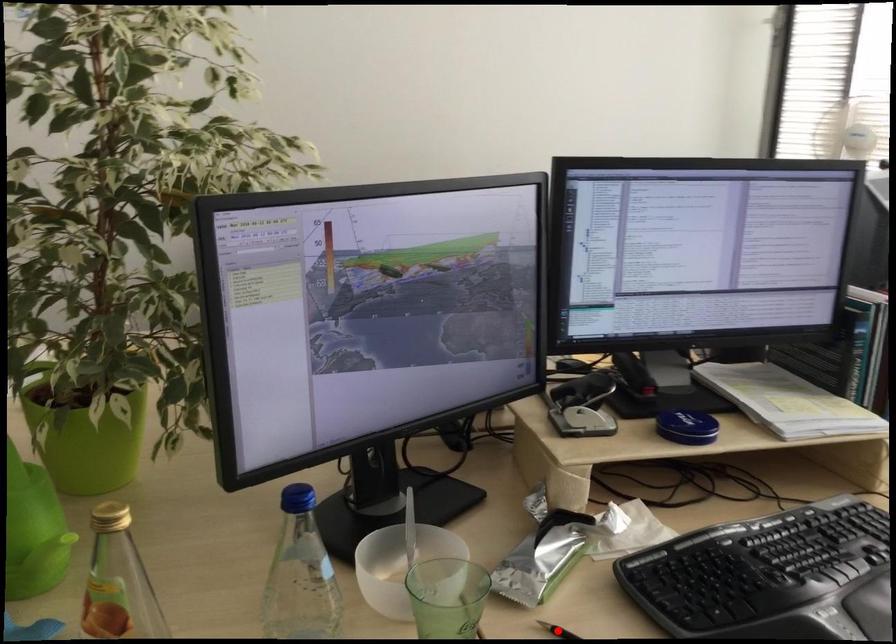
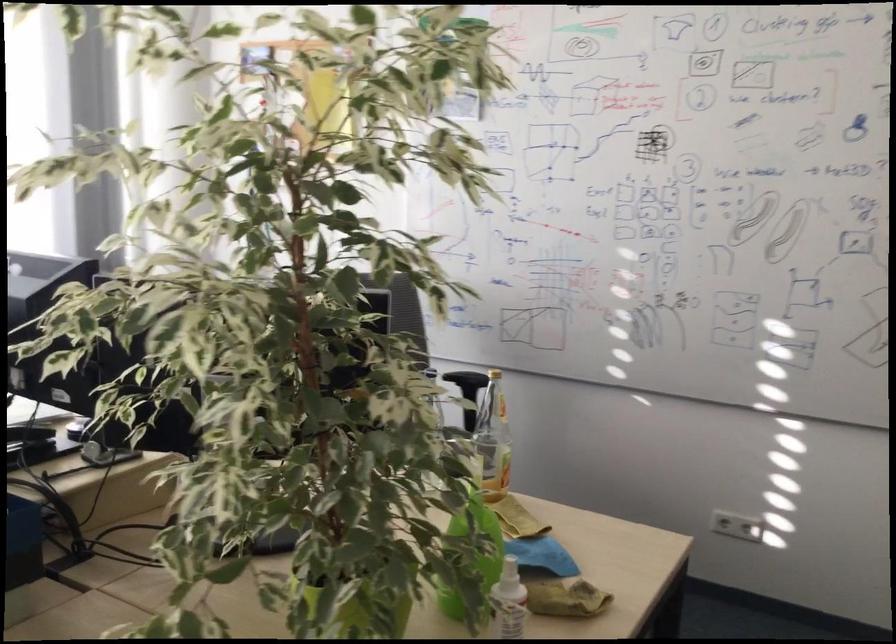
Question: I am providing you with two images of the same scene from different viewpoints. A red point is marked on the first image. Can you still see the location of the red point in image 2?

Choices:
 (A) Yes
 (B) No

Answer: (B)